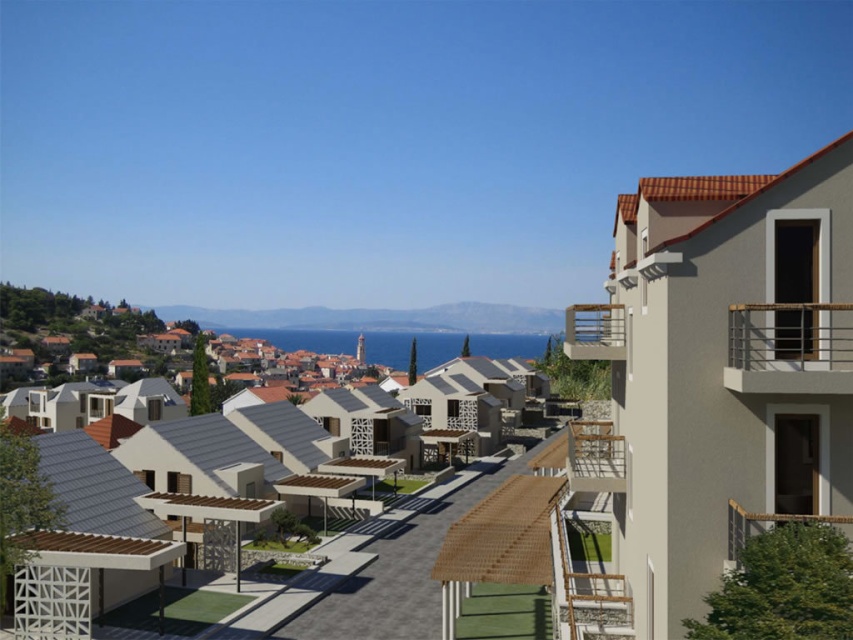
You are standing on the brown wooden balcony at right and want to reach the metallic silver railing at upper right. Which direction should you move to get there?

The metallic silver railing at upper right is located above the brown wooden balcony at right, so you should move upward to reach it.

You are standing at the entrance of the coastal residential area looking towards the buildings. Which direction should you look to see the brown wooden balcony at upper right?

You should look towards the upper right direction to see the brown wooden balcony at upper right as it is located at point (x=595, y=332).